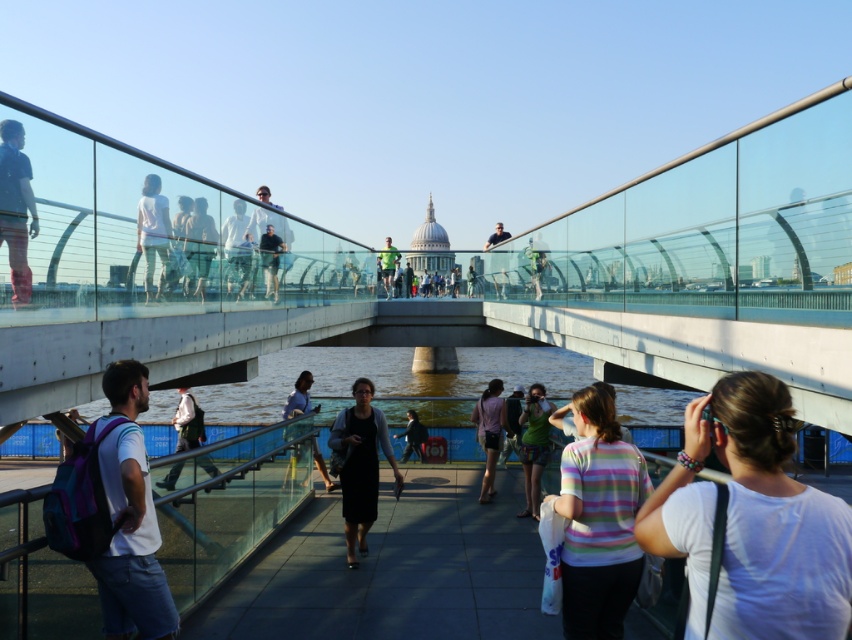
How far apart are light brown leather backpack at lower left and dark blue shirt at upper center?

The distance of light brown leather backpack at lower left from dark blue shirt at upper center is 65.41 feet.

Can you confirm if light brown leather backpack at lower left is positioned to the left of dark blue shirt at upper center?

Correct, you'll find light brown leather backpack at lower left to the left of dark blue shirt at upper center.

Where is `light brown leather backpack at lower left`? The height and width of the screenshot is (640, 852). light brown leather backpack at lower left is located at coordinates (188, 420).

Is point (193, 237) behind point (288, 404)?

No, it is in front of (288, 404).

Which is more to the left, matte black jacket at upper center or matte black shirt at center?

matte black jacket at upper center

Describe the element at coordinates (199, 246) in the screenshot. I see `matte black jacket at upper center` at that location.

Locate an element on the screen. matte black jacket at upper center is located at coordinates pyautogui.click(x=199, y=246).

Can you confirm if smooth concrete pavement at center is taller than white fabric at center?

No, smooth concrete pavement at center is not taller than white fabric at center.

Is the position of smooth concrete pavement at center less distant than that of white fabric at center?

No, smooth concrete pavement at center is behind white fabric at center.

Is point (312, 593) in front of point (681, 454)?

No, (312, 593) is further to viewer.

The image size is (852, 640). I want to click on smooth concrete pavement at center, so click(x=393, y=570).